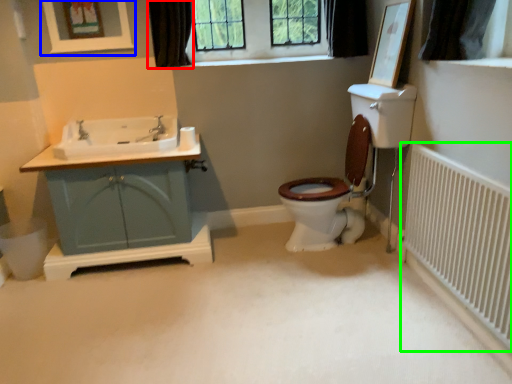
Question: Based on their relative distances, which object is nearer to curtain (highlighted by a red box)? Choose from picture frame (highlighted by a blue box) and radiator (highlighted by a green box).

Choices:
 (A) picture frame
 (B) radiator

Answer: (A)